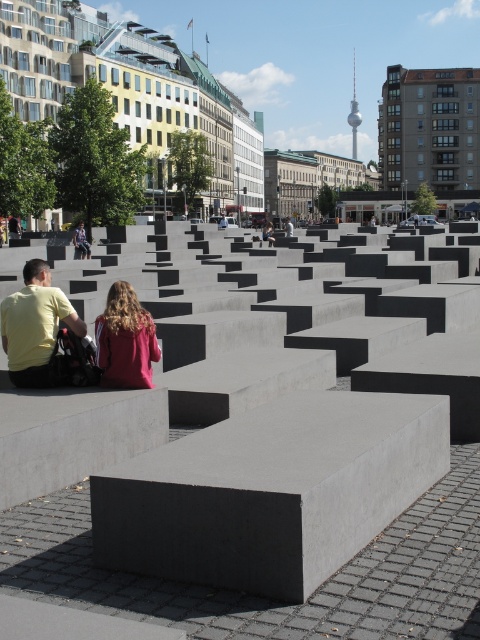
Between smooth gray concrete at center and yellow matte shirt at lower left, which one has less height?

With less height is smooth gray concrete at center.

Does point (325, 500) come closer to viewer compared to point (75, 328)?

Yes.

Is point (333, 547) more distant than point (19, 348)?

No, it is in front of (19, 348).

Find the location of a particular element. The image size is (480, 640). smooth gray concrete at center is located at coordinates pyautogui.click(x=272, y=492).

Does maroon fabric hair at center lie behind matte gray bench at center?

No, it is in front of matte gray bench at center.

Locate an element on the screen. The height and width of the screenshot is (640, 480). maroon fabric hair at center is located at coordinates (124, 340).

Where is `maroon fabric hair at center`? This screenshot has height=640, width=480. maroon fabric hair at center is located at coordinates (124, 340).

Between yellow matte shirt at lower left and maroon fabric hair at center, which one is positioned lower?

Positioned lower is yellow matte shirt at lower left.

Does yellow matte shirt at lower left have a smaller size compared to maroon fabric hair at center?

Actually, yellow matte shirt at lower left might be larger than maroon fabric hair at center.

Locate an element on the screen. Image resolution: width=480 pixels, height=640 pixels. yellow matte shirt at lower left is located at coordinates (35, 324).

This screenshot has width=480, height=640. Identify the location of yellow matte shirt at lower left. (35, 324).